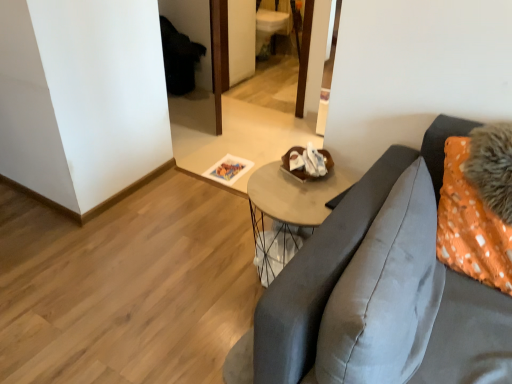
Question: Is there a large distance between wooden mirror at center and satin gray pillow at right?

Choices:
 (A) no
 (B) yes

Answer: (B)

Question: Can you confirm if wooden mirror at center is positioned to the right of satin gray pillow at right?

Choices:
 (A) yes
 (B) no

Answer: (B)

Question: Is wooden mirror at center thinner than satin gray pillow at right?

Choices:
 (A) no
 (B) yes

Answer: (A)

Question: Does wooden mirror at center lie behind satin gray pillow at right?

Choices:
 (A) no
 (B) yes

Answer: (B)

Question: Can you confirm if wooden mirror at center is bigger than satin gray pillow at right?

Choices:
 (A) yes
 (B) no

Answer: (A)

Question: From a real-world perspective, is wooden mirror at center located beneath satin gray pillow at right?

Choices:
 (A) yes
 (B) no

Answer: (A)

Question: Is wooden mirror at center taller than wooden round table at center?

Choices:
 (A) no
 (B) yes

Answer: (B)

Question: Is wooden mirror at center wider than wooden round table at center?

Choices:
 (A) yes
 (B) no

Answer: (A)

Question: Can you see wooden mirror at center touching wooden round table at center?

Choices:
 (A) yes
 (B) no

Answer: (B)

Question: Considering the relative positions of wooden mirror at center and wooden round table at center in the image provided, is wooden mirror at center behind wooden round table at center?

Choices:
 (A) yes
 (B) no

Answer: (A)

Question: From a real-world perspective, does wooden mirror at center sit lower than wooden round table at center?

Choices:
 (A) no
 (B) yes

Answer: (A)

Question: Can you confirm if wooden mirror at center is shorter than wooden round table at center?

Choices:
 (A) no
 (B) yes

Answer: (A)

Question: Is wooden round table at center smaller than wooden mirror at center?

Choices:
 (A) yes
 (B) no

Answer: (A)